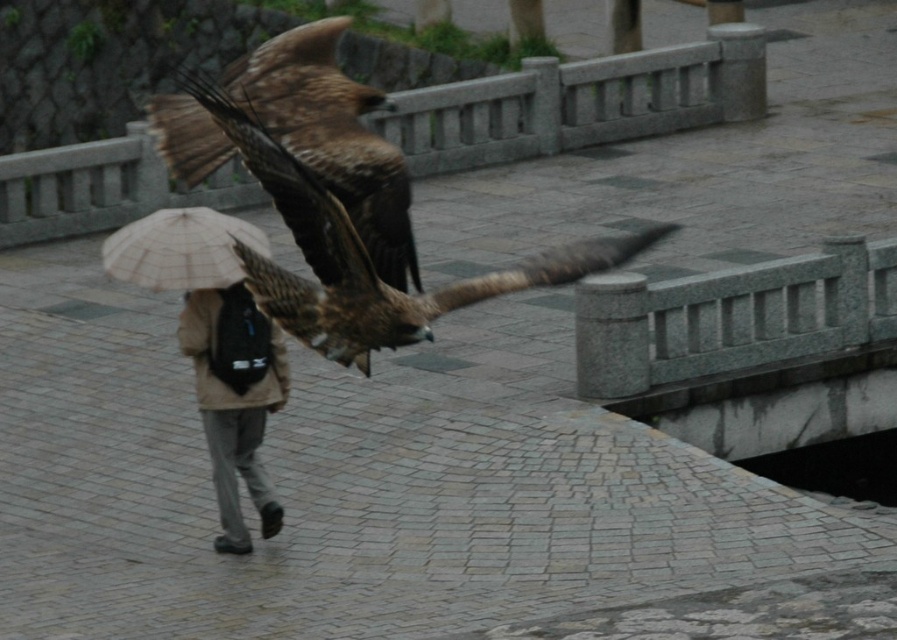
Based on the photo, can you confirm if brown feathered eagle at center is shorter than beige fabric umbrella at center?

No, brown feathered eagle at center is not shorter than beige fabric umbrella at center.

Is the position of brown feathered eagle at center less distant than that of beige fabric umbrella at center?

That is True.

What do you see at coordinates (366, 253) in the screenshot?
I see `brown feathered eagle at center` at bounding box center [366, 253].

This screenshot has width=897, height=640. I want to click on brown feathered eagle at center, so point(366,253).

Is the position of brown feathered falcon at upper center more distant than that of beige fabric umbrella at center?

No, it is in front of beige fabric umbrella at center.

Between point (414, 273) and point (218, 240), which one is positioned in front?

Point (414, 273)

Which is in front, point (381, 104) or point (212, 218)?

Point (381, 104) is more forward.

This screenshot has width=897, height=640. I want to click on brown feathered falcon at upper center, so click(332, 136).

Looking at this image, who is more forward, (402, 308) or (381, 220)?

Positioned in front is point (402, 308).

How much distance is there between brown feathered eagle at center and brown feathered falcon at upper center?

brown feathered eagle at center and brown feathered falcon at upper center are 5.89 feet apart.

Between point (319, 294) and point (312, 138), which one is positioned behind?

The point (319, 294) is behind.

At what (x,y) coordinates should I click in order to perform the action: click on brown feathered eagle at center. Please return your answer as a coordinate pair (x, y). Image resolution: width=897 pixels, height=640 pixels. Looking at the image, I should click on (366, 253).